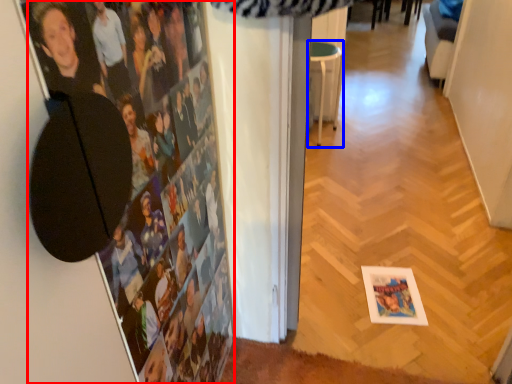
Question: Which object appears farthest to the camera in this image, person (highlighted by a red box) or furniture (highlighted by a blue box)?

Choices:
 (A) person
 (B) furniture

Answer: (B)